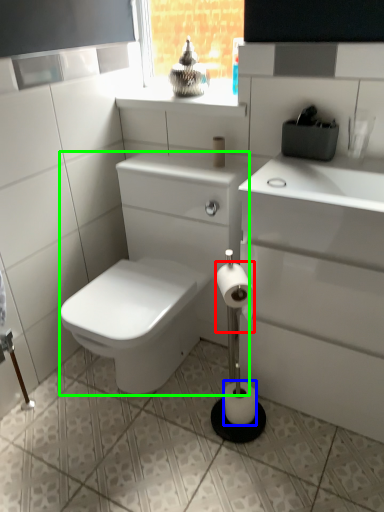
Question: Which is farther away from toilet paper (highlighted by a red box)? toilet paper (highlighted by a blue box) or porcelain (highlighted by a green box)?

Choices:
 (A) toilet paper
 (B) porcelain

Answer: (B)